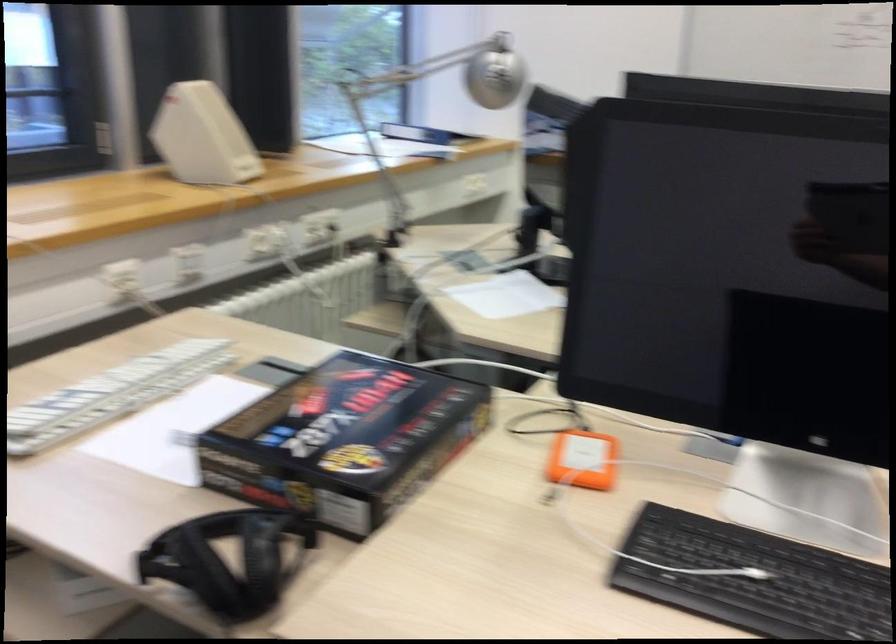
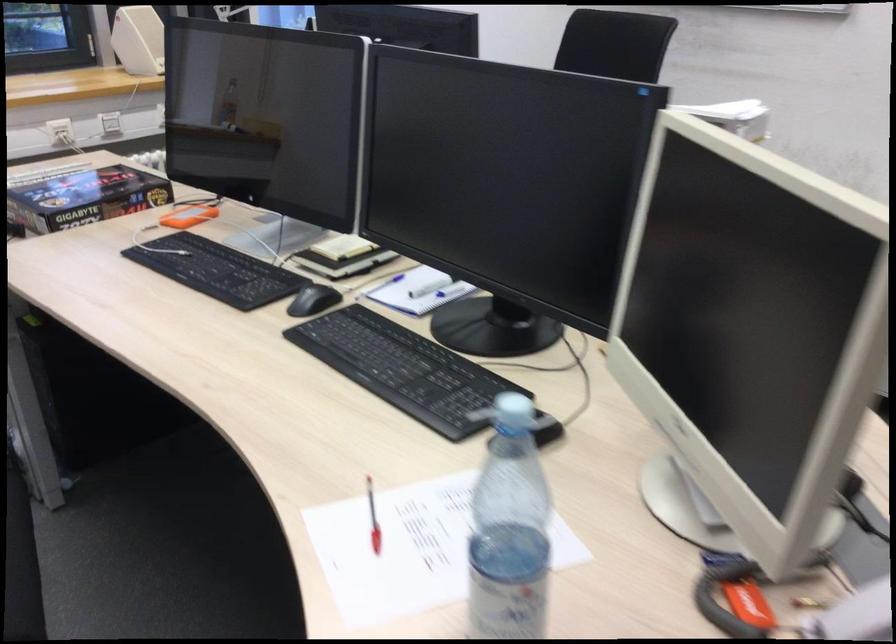
Locate, in the second image, the point that corresponds to point 367,431 in the first image.

(83, 198)